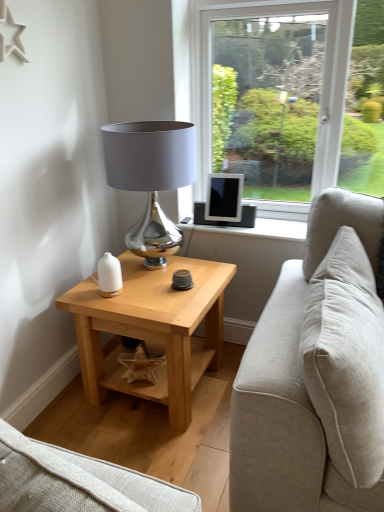
You are a GUI agent. You are given a task and a screenshot of the screen. Output one action in this format:
    pyautogui.click(x=<x>, y=<y>)
    Task: Click on the vacant area on top of light wood/texture side table at lower left (from a real-world perspective)
    The image size is (384, 512).
    Given the screenshot: What is the action you would take?
    pyautogui.click(x=152, y=284)